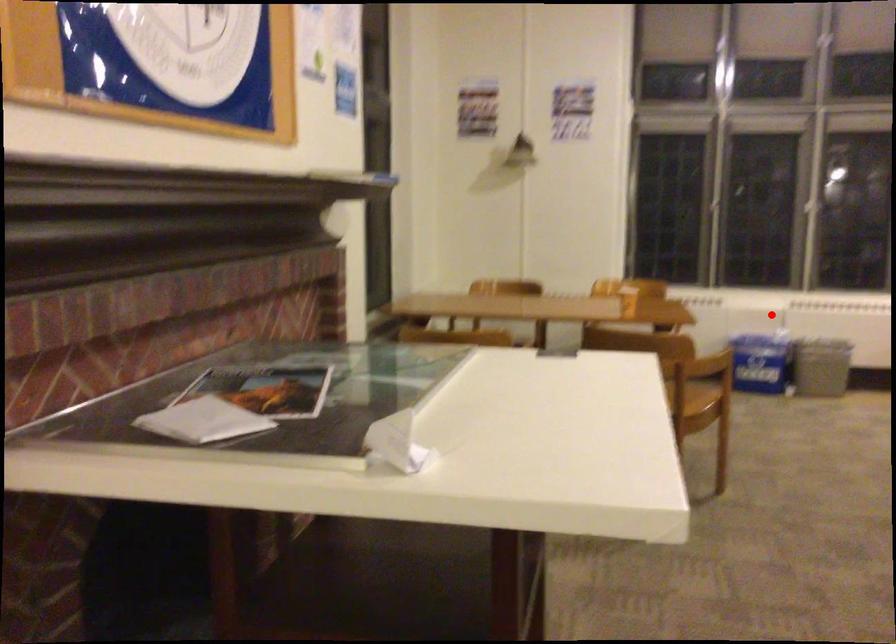
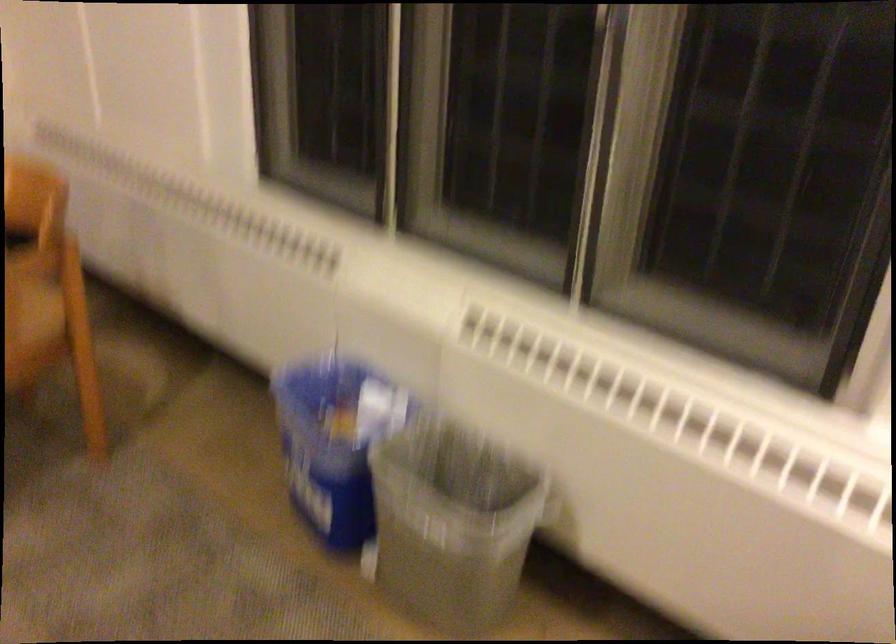
The point at the highlighted location is marked in the first image. Where is the corresponding point in the second image?

(334, 442)